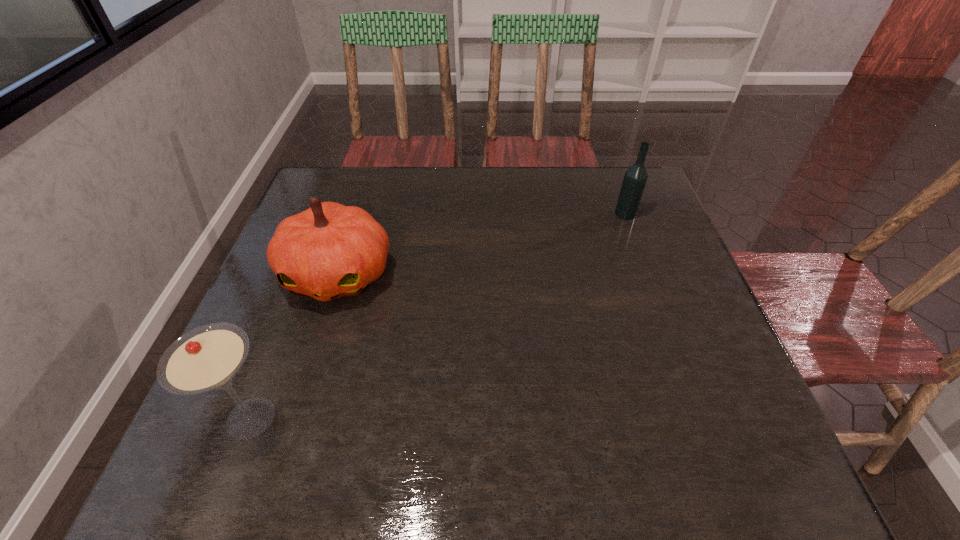
Identify which object is the second nearest to the rightmost object. Please provide its 2D coordinates. Your answer should be formatted as a tuple, i.e. [(x, y)], where the tuple contains the x and y coordinates of a point satisfying the conditions above.

[(207, 358)]

The width and height of the screenshot is (960, 540). Find the location of `object that is the second closest to the pumpkin`. object that is the second closest to the pumpkin is located at coordinates (635, 178).

Find the location of a particular element. Image resolution: width=960 pixels, height=540 pixels. free space that satisfies the following two spatial constraints: 1. on the back side of the farthest object; 2. on the right side of the nearest object is located at coordinates (329, 213).

Locate an element on the screen. This screenshot has height=540, width=960. vacant space that satisfies the following two spatial constraints: 1. on the back side of the rightmost object; 2. on the right side of the nearest object is located at coordinates (329, 213).

You are a GUI agent. You are given a task and a screenshot of the screen. Output one action in this format:
    pyautogui.click(x=<x>, y=<y>)
    Task: Click on the free space that satisfies the following two spatial constraints: 1. on the back side of the rightmost object; 2. on the left side of the nearest object
    Image resolution: width=960 pixels, height=540 pixels.
    Given the screenshot: What is the action you would take?
    pyautogui.click(x=329, y=213)